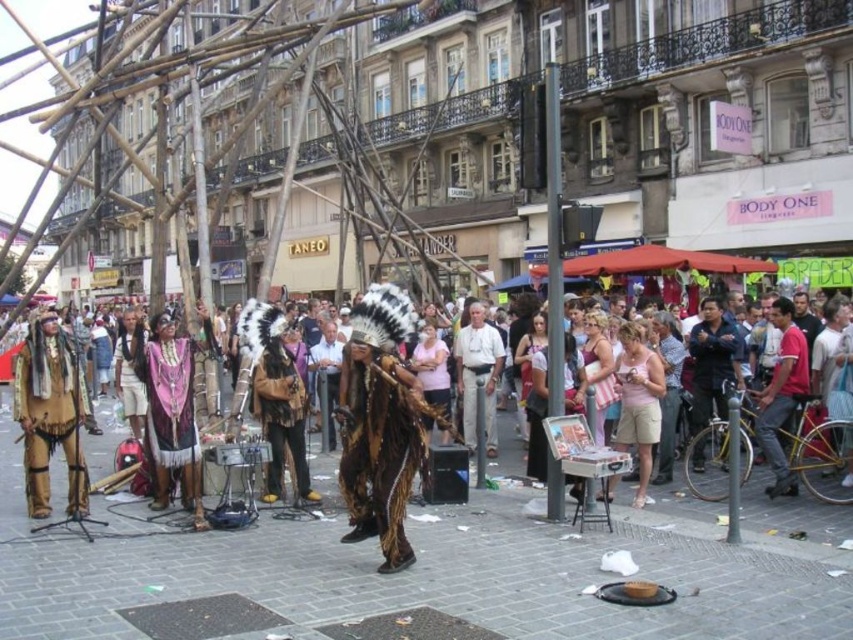
Question: Where is brown leather headdress at center located in relation to leather fringe headdress at center in the image?

Choices:
 (A) below
 (B) above

Answer: (A)

Question: Which object appears closest to the camera in this image?

Choices:
 (A) brown leather headdress at center
 (B) brown furry headdress at center
 (C) light beige pants at center
 (D) leather fringe headdress at center

Answer: (B)

Question: Which point is farther from the camera taking this photo?

Choices:
 (A) (277, 449)
 (B) (473, 337)
 (C) (39, 502)

Answer: (B)

Question: Estimate the real-world distances between objects in this image. Which object is farther from the brown furry headdress at center?

Choices:
 (A) red shirt at center
 (B) brown leather headdress at center
 (C) velvet purple headdress at center

Answer: (A)

Question: Is brown leather headdress at center above velvet purple headdress at center?

Choices:
 (A) yes
 (B) no

Answer: (A)

Question: From the image, what is the correct spatial relationship of brown furry headdress at center in relation to brown leather headdress at center?

Choices:
 (A) left
 (B) right

Answer: (B)